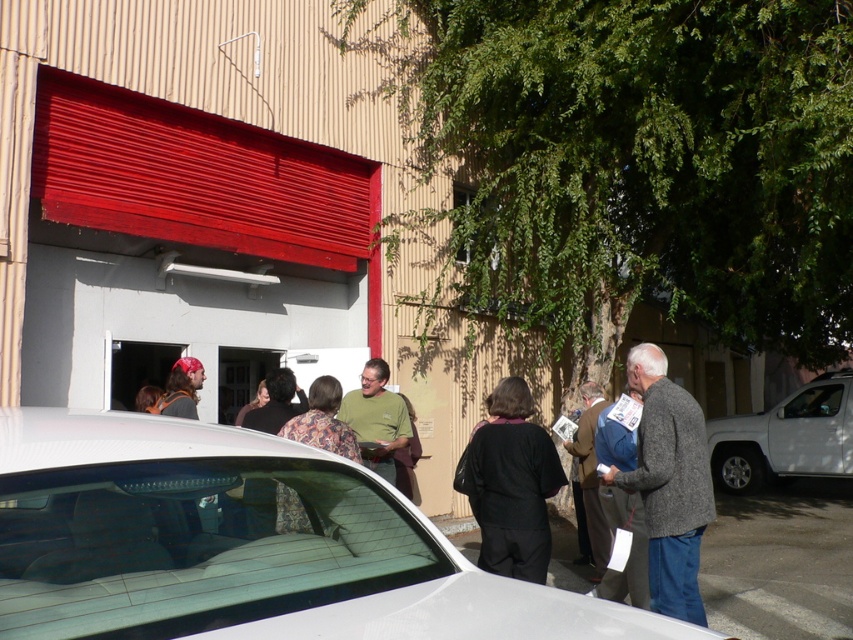
Question: Does white glossy car at center appear over black matte coat at center?

Choices:
 (A) yes
 (B) no

Answer: (A)

Question: Considering the real-world distances, which object is closest to the brown leather jacket at center?

Choices:
 (A) green matte shirt at center
 (B) black matte coat at center
 (C) gray wool sweater at right
 (D) white matte truck at right

Answer: (A)

Question: Which of these objects is positioned closest to the gray wool sweater at center?

Choices:
 (A) white matte truck at right
 (B) brown leather jacket at center

Answer: (B)

Question: Is white matte truck at right smaller than brown leather jacket at center?

Choices:
 (A) yes
 (B) no

Answer: (B)

Question: Which point is farther from the camera taking this photo?

Choices:
 (A) (822, 385)
 (B) (619, 454)
 (C) (581, 424)
 (D) (660, 355)

Answer: (A)

Question: Does black matte coat at center have a smaller size compared to floral-patterned shirt at center?

Choices:
 (A) no
 (B) yes

Answer: (A)